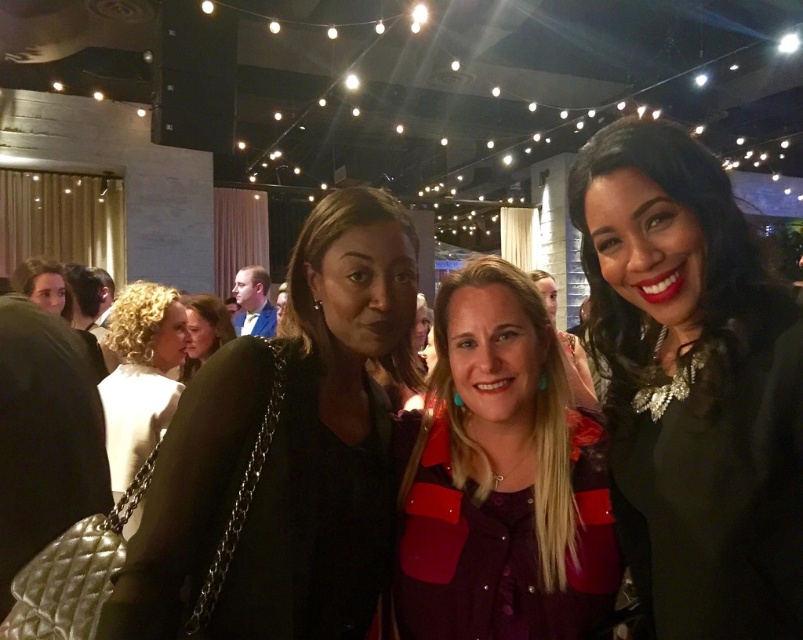
You are standing at the center of the room and want to move towards the point marked as point (479, 388). Is this point closer to you than the other point marked as point (137, 369)?

Yes, point (479, 388) is closer to you because it is in front of point (137, 369).

You are at the lively indoor gathering and want to take a photo of both the point at coordinates (624, 164) and the point at (465, 314). Which point should you focus on first to ensure both are in clear view?

You should focus on point (624, 164) first because it is closer to the viewer than point (465, 314). This ensures that both points will be in clear view when taking the photo.

You are at the center of the room and want to pick up the black quilted purse at left. Which direction should you move to reach it?

The black quilted purse at left is located at point 0.708 on the x and 0.355 on the y, so you should move to the left and slightly forward to reach it.